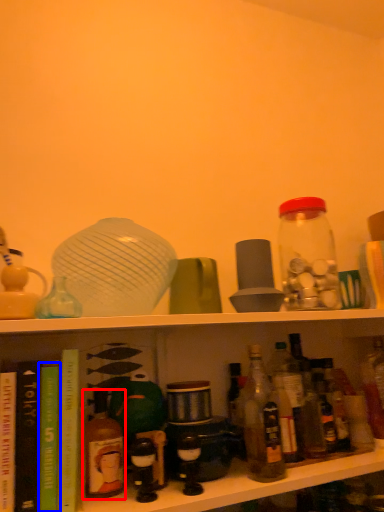
Question: Which object appears closest to the camera in this image, bottle (highlighted by a red box) or book (highlighted by a blue box)?

Choices:
 (A) bottle
 (B) book

Answer: (B)